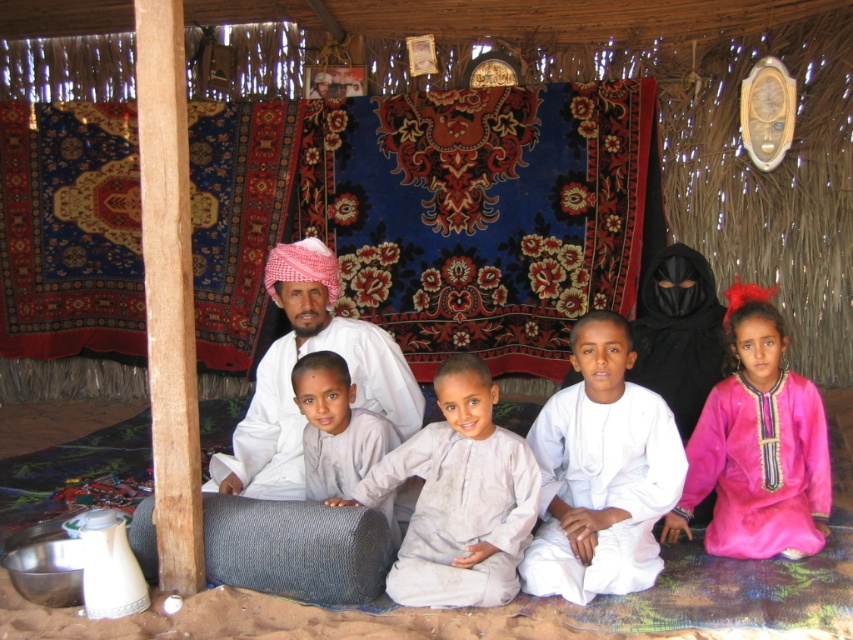
Between pink satin dress at center and white cotton clothing at center, which one is positioned higher?

Positioned higher is pink satin dress at center.

Is pink satin dress at center to the right of white cotton clothing at center from the viewer's perspective?

Correct, you'll find pink satin dress at center to the right of white cotton clothing at center.

Who is more distant from viewer, (788, 422) or (262, 529)?

The point (788, 422) is more distant.

You are a GUI agent. You are given a task and a screenshot of the screen. Output one action in this format:
    pyautogui.click(x=<x>, y=<y>)
    Task: Click on the pink satin dress at center
    
    Given the screenshot: What is the action you would take?
    pyautogui.click(x=758, y=445)

Does light gray cotton shirt at center appear under light beige fabric at center?

Indeed, light gray cotton shirt at center is positioned under light beige fabric at center.

Can you confirm if light gray cotton shirt at center is positioned to the left of light beige fabric at center?

No, light gray cotton shirt at center is not to the left of light beige fabric at center.

Does point (486, 400) lie in front of point (306, 477)?

Yes, it is in front of point (306, 477).

Identify the location of light gray cotton shirt at center. This screenshot has width=853, height=640. tap(459, 497).

Does point (355, 540) lie in front of point (349, 406)?

Yes.

Is white cotton clothing at center taller than light beige fabric at center?

In fact, white cotton clothing at center may be shorter than light beige fabric at center.

Between point (317, 566) and point (366, 456), which one is positioned behind?

Positioned behind is point (366, 456).

Where is `white cotton clothing at center`? The image size is (853, 640). white cotton clothing at center is located at coordinates (296, 548).